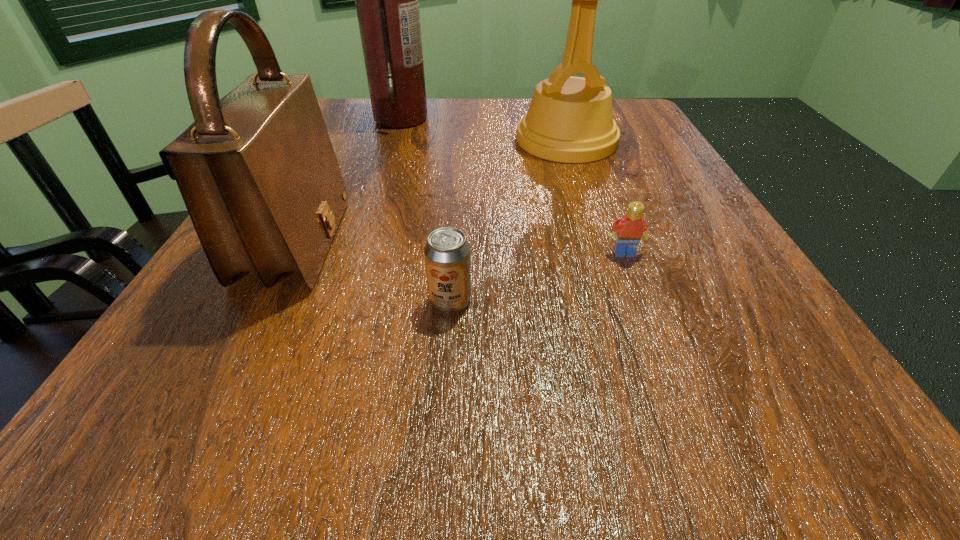
At what (x,y) coordinates should I click in order to perform the action: click on the tallest object. Please return your answer as a coordinate pair (x, y). Looking at the image, I should click on (387, 0).

The height and width of the screenshot is (540, 960). What are the coordinates of `award` in the screenshot? It's located at [570, 119].

What are the coordinates of `shoulder bag` in the screenshot? It's located at (257, 171).

You are a GUI agent. You are given a task and a screenshot of the screen. Output one action in this format:
    pyautogui.click(x=<x>, y=<y>)
    Task: Click on the beer can
    
    Given the screenshot: What is the action you would take?
    pyautogui.click(x=447, y=253)

This screenshot has width=960, height=540. Identify the location of Lego. (630, 228).

At what (x,y) coordinates should I click in order to perform the action: click on free space located on the front-facing side of the fire extinguisher. Please return your answer as a coordinate pair (x, y). The height and width of the screenshot is (540, 960). Looking at the image, I should click on (519, 118).

I want to click on vacant space positioned 0.160m on the front of the award, so click(x=588, y=207).

At what (x,y) coordinates should I click in order to perform the action: click on vacant space located on the front flap of the third shortest object. Please return your answer as a coordinate pair (x, y). Looking at the image, I should click on (394, 242).

Where is `vacant space situated 0.210m on the back of the beer can`? vacant space situated 0.210m on the back of the beer can is located at coordinates (457, 206).

What are the coordinates of `vacant space positioned on the front-facing side of the Lego` in the screenshot? It's located at [684, 408].